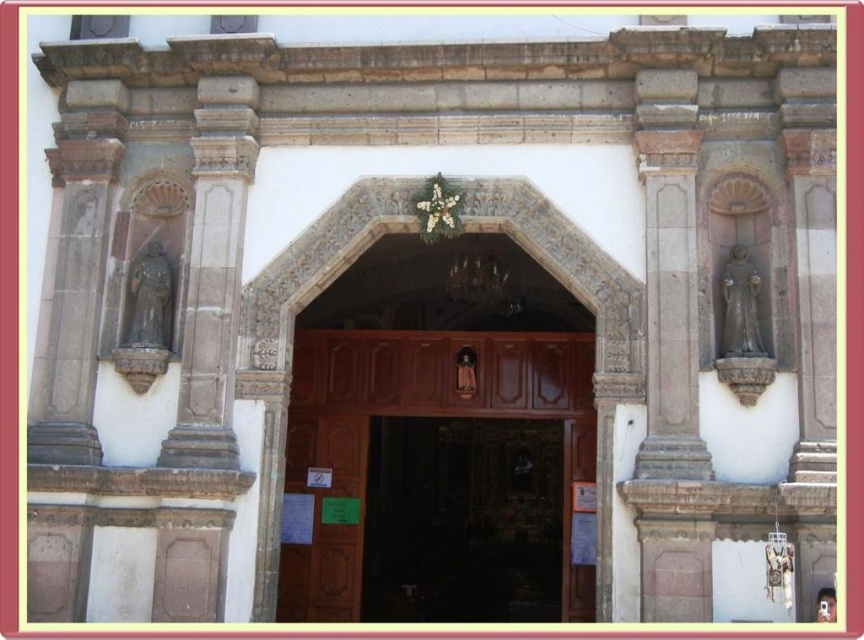
From the picture: You are a delivery person trying to deliver a package to the church entrance. You see two doors at the center, a brown polished wood door at center and a brown wooden door at center. Which door should you use for the delivery?

The brown polished wood door at center is larger in size than the brown wooden door at center, so you should use the brown polished wood door at center for the delivery since it is bigger and likely the main entrance.

You are an architect designing a new building and want to ensure that the entrance maintains a balanced aesthetic between the brown polished wood door at center and the smooth stone statue at left. Given their sizes, which element should be placed further back to achieve this balance?

The smooth stone statue at left should be placed further back to balance the larger size of the brown polished wood door at center.